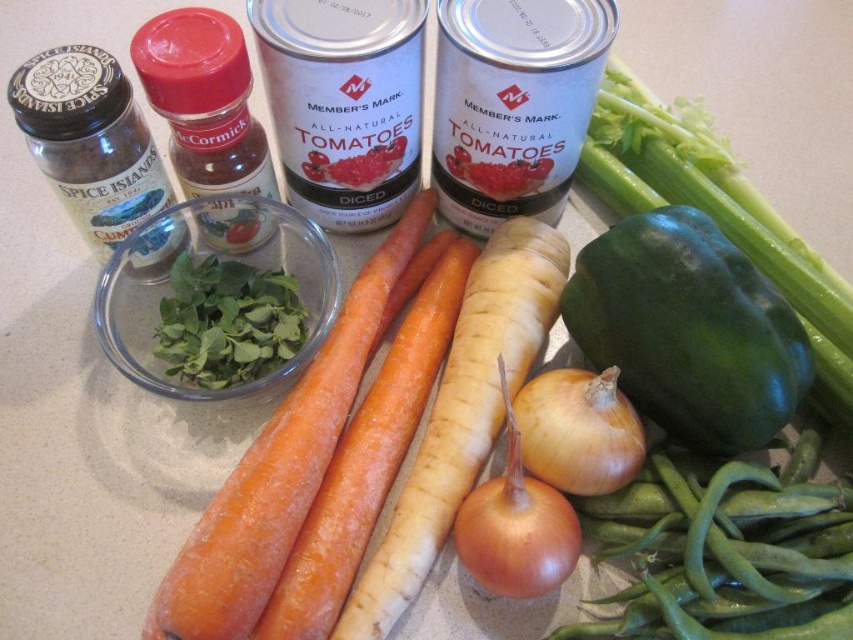
At what (x,y) coordinates should I click in order to perform the action: click on green matte bell pepper at center-right. Please return your answer as a coordinate pair (x, y). The width and height of the screenshot is (853, 640). Looking at the image, I should click on (688, 330).

Between green matte bell pepper at center-right and green smooth celery at center right, which one has less height?

green matte bell pepper at center-right

Describe the element at coordinates (688, 330) in the screenshot. Image resolution: width=853 pixels, height=640 pixels. I see `green matte bell pepper at center-right` at that location.

What are the coordinates of `green matte bell pepper at center-right` in the screenshot? It's located at (688, 330).

Which is below, green smooth celery at center right or brown matte onion at lower center?

brown matte onion at lower center

Which is in front, point (695, 192) or point (471, 564)?

Point (471, 564)

Which is in front, point (720, 205) or point (558, 529)?

Point (558, 529) is in front.

Identify the location of green smooth celery at center right. (717, 216).

Which is behind, point (186, 540) or point (549, 432)?

The point (549, 432) is behind.

This screenshot has width=853, height=640. In order to click on orange smooth carrot at center in this screenshot , I will do `click(281, 467)`.

Identify the location of orange smooth carrot at center. The height and width of the screenshot is (640, 853). (281, 467).